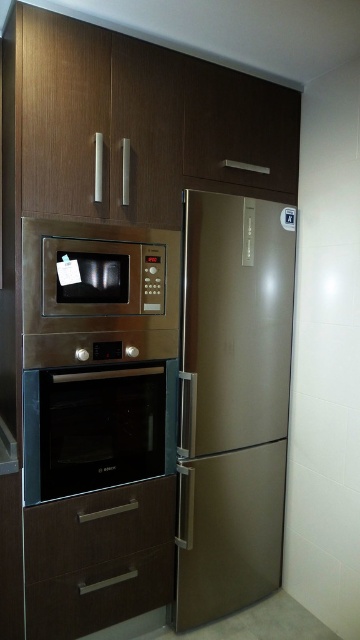
Can you confirm if stainless steel oven at center is smaller than brown matte drawer at lower center?

No, stainless steel oven at center is not smaller than brown matte drawer at lower center.

Is stainless steel oven at center to the right of brown matte drawer at lower center from the viewer's perspective?

Yes, stainless steel oven at center is to the right of brown matte drawer at lower center.

At what (x,y) coordinates should I click in order to perform the action: click on stainless steel oven at center. Please return your answer as a coordinate pair (x, y). This screenshot has width=360, height=640. Looking at the image, I should click on (96, 428).

Is gold metallic refrigerator at center positioned behind brown matte drawer at lower center?

Yes, gold metallic refrigerator at center is further from the viewer.

This screenshot has height=640, width=360. I want to click on gold metallic refrigerator at center, so 231,403.

Between point (231, 460) and point (57, 620), which one is positioned in front?

Point (57, 620) is in front.

Identify the location of gold metallic refrigerator at center. The width and height of the screenshot is (360, 640). (231, 403).

Does stainless steel oven at center have a lesser width compared to brown wood drawer at lower center?

Correct, stainless steel oven at center's width is less than brown wood drawer at lower center's.

Between stainless steel oven at center and brown wood drawer at lower center, which one is positioned higher?

stainless steel oven at center is above.

Is point (120, 406) less distant than point (38, 563)?

No.

Where is `stainless steel oven at center`? stainless steel oven at center is located at coordinates (96, 428).